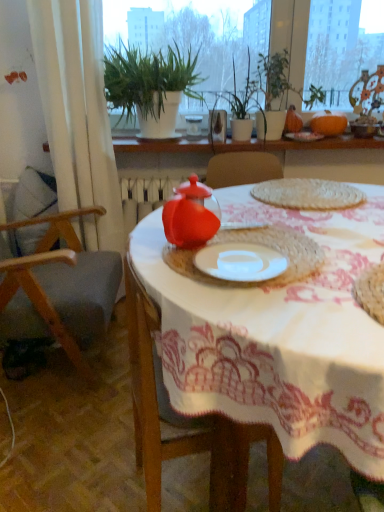
Where is `free space between white matte plate at center and matte plastic teapot at center, positioned as the first tableware in front-to-back order`? This screenshot has height=512, width=384. free space between white matte plate at center and matte plastic teapot at center, positioned as the first tableware in front-to-back order is located at coordinates (226, 244).